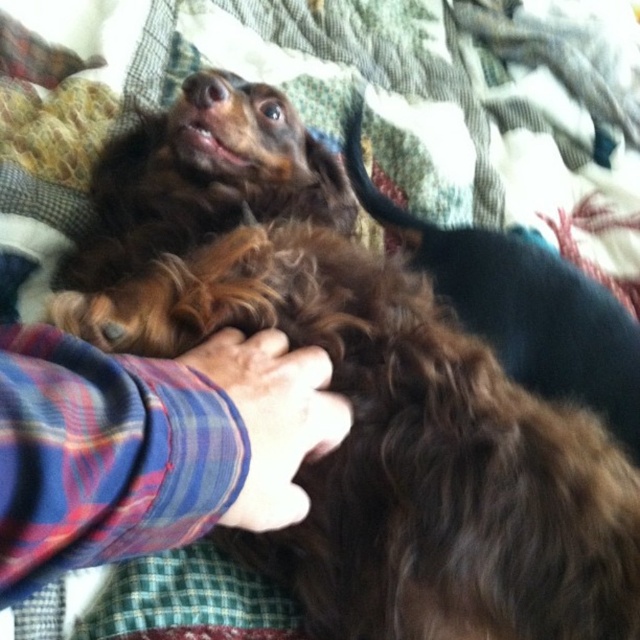
Which is more to the right, plaid fabric hand at center or brown curly fur at center?

brown curly fur at center

Does plaid fabric hand at center have a greater width compared to brown curly fur at center?

In fact, plaid fabric hand at center might be narrower than brown curly fur at center.

Which is in front, point (284, 448) or point (490, 253)?

Positioned in front is point (284, 448).

I want to click on plaid fabric hand at center, so click(148, 445).

Does plaid fabric hand at center have a lesser height compared to brown curly fur paw at center?

Correct, plaid fabric hand at center is not as tall as brown curly fur paw at center.

You are a GUI agent. You are given a task and a screenshot of the screen. Output one action in this format:
    pyautogui.click(x=<x>, y=<y>)
    Task: Click on the plaid fabric hand at center
    The height and width of the screenshot is (640, 640).
    Given the screenshot: What is the action you would take?
    pyautogui.click(x=148, y=445)

Does point (620, 308) come behind point (211, 376)?

Yes, point (620, 308) is farther from viewer.

Between brown curly fur at center and brown curly fur paw at center, which one has less height?

Standing shorter between the two is brown curly fur paw at center.

What do you see at coordinates (522, 305) in the screenshot? This screenshot has width=640, height=640. I see `brown curly fur at center` at bounding box center [522, 305].

What are the coordinates of `brown curly fur at center` in the screenshot? It's located at (522, 305).